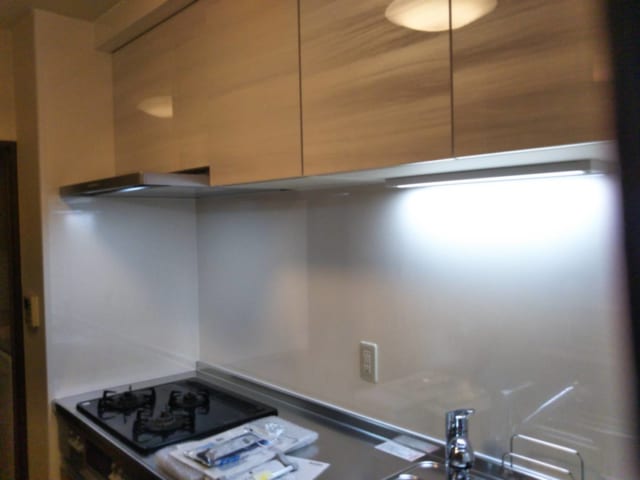
Image resolution: width=640 pixels, height=480 pixels. I want to click on burner 3, so click(184, 395).